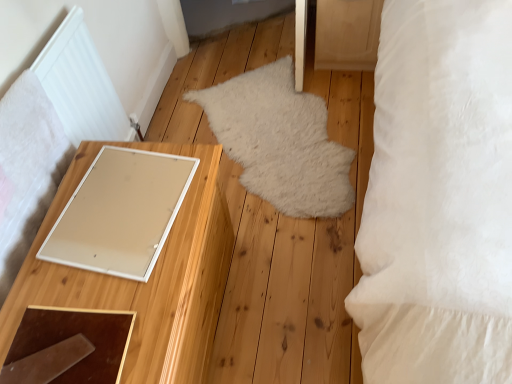
At what (x,y) coordinates should I click in order to perform the action: click on vacant area that is in front of white glossy board at left. Please return your answer as a coordinate pair (x, y). Looking at the image, I should click on point(110,293).